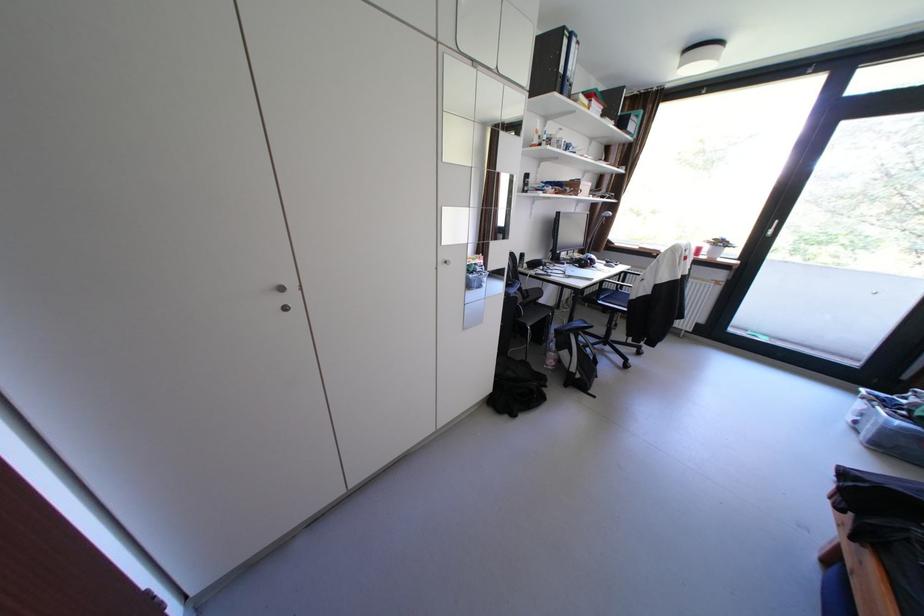
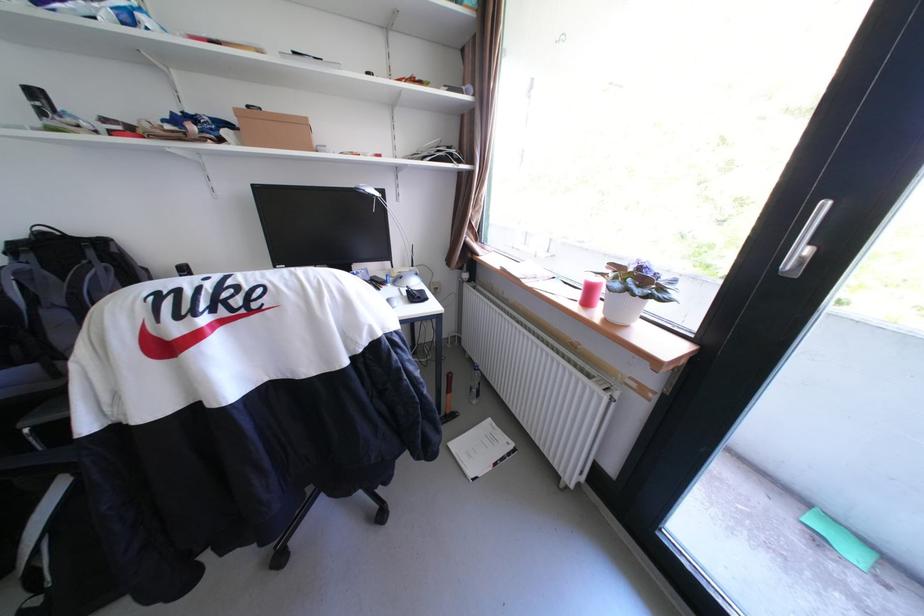
In the second image, find the point that corresponds to (x=710, y=249) in the first image.

(601, 291)